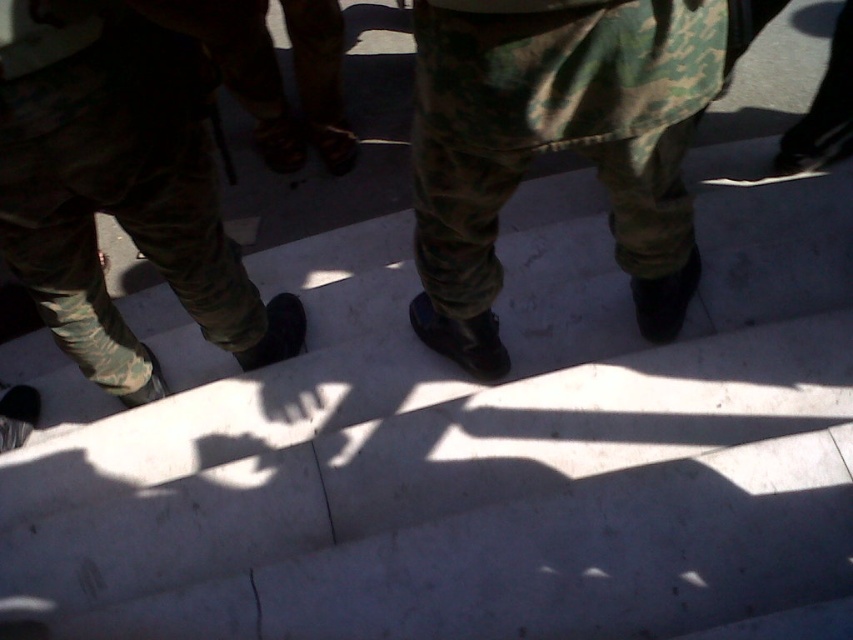
You are observing a group of people walking up white stairs. You notice two sets of camouflage pants at center and camouflage pants at left. Which set of camouflage pants is bigger in size?

The camouflage pants at center has a larger size compared to camouflage pants at left.

You are a photographer observing the scene. You notice two sets of camouflage pants at center and camouflage pants at left. Which set of camouflage pants is covering part of the other one?

The camouflage pants at center is positioned over camouflage pants at left, so it is covering part of the camouflage pants at left.